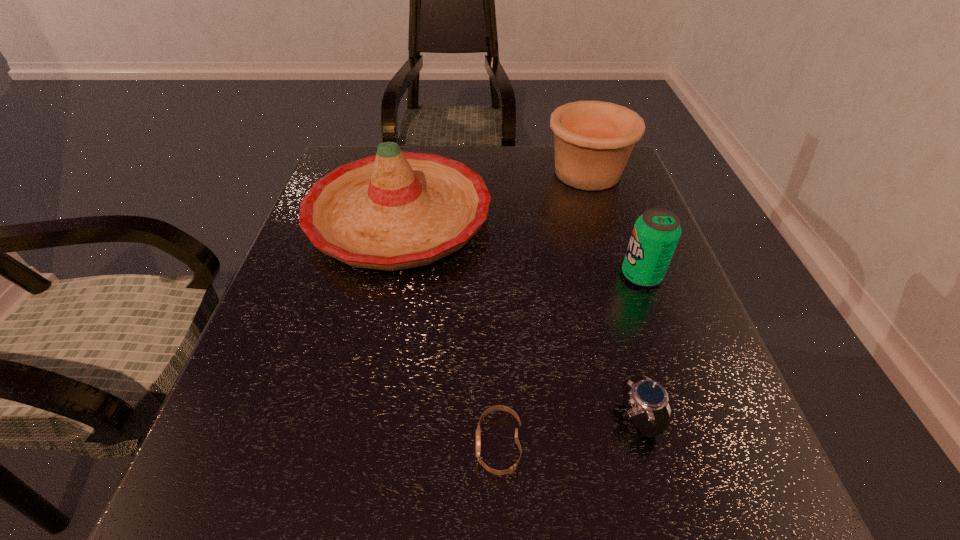
Find the location of a particular element. The height and width of the screenshot is (540, 960). pottery present at the right edge is located at coordinates (593, 140).

This screenshot has width=960, height=540. I want to click on pop soda that is positioned at the right edge, so click(x=656, y=233).

Locate an element on the screen. The image size is (960, 540). watch that is at the right edge is located at coordinates (641, 394).

Locate an element on the screen. This screenshot has width=960, height=540. object at the far left corner is located at coordinates (395, 210).

Identify the location of object located at the far right corner. The height and width of the screenshot is (540, 960). (593, 140).

Identify the location of vacant region at the far edge. This screenshot has width=960, height=540. (516, 152).

The height and width of the screenshot is (540, 960). I want to click on blank area at the near edge, so click(444, 489).

The width and height of the screenshot is (960, 540). In the image, there is a desktop. Identify the location of vacant space at the left edge. (280, 333).

I want to click on free space at the right edge of the desktop, so click(x=679, y=302).

Locate an element on the screen. This screenshot has height=540, width=960. vacant area at the far left corner of the desktop is located at coordinates (337, 167).